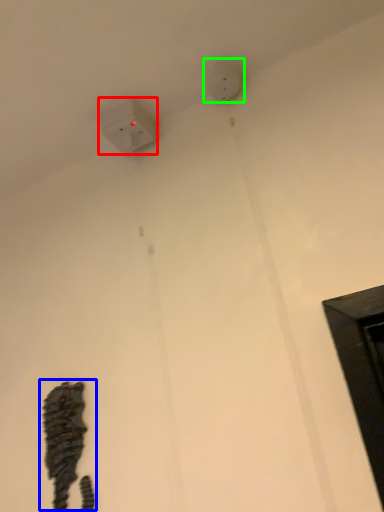
Question: Considering the real-world distances, which object is closest to power plugs and sockets (highlighted by a red box)? animal (highlighted by a blue box) or electric outlet (highlighted by a green box).

Choices:
 (A) animal
 (B) electric outlet

Answer: (B)